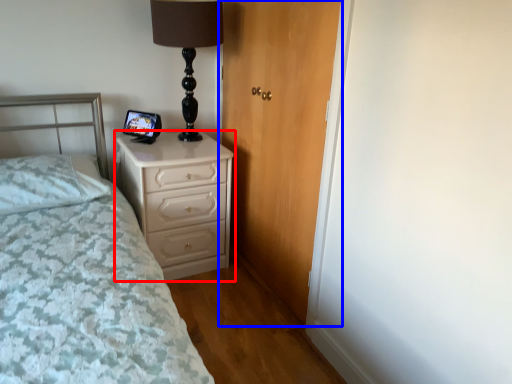
Question: Which object is further to the camera taking this photo, chest of drawers (highlighted by a red box) or door (highlighted by a blue box)?

Choices:
 (A) chest of drawers
 (B) door

Answer: (A)